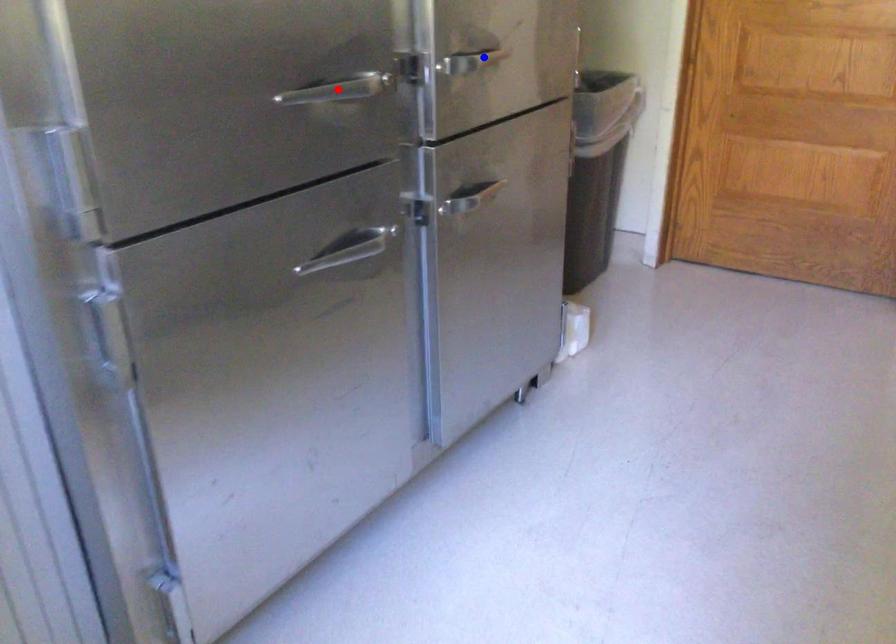
Question: Which of the two points in the image is closer to the camera?

Choices:
 (A) Blue point is closer.
 (B) Red point is closer.

Answer: (B)